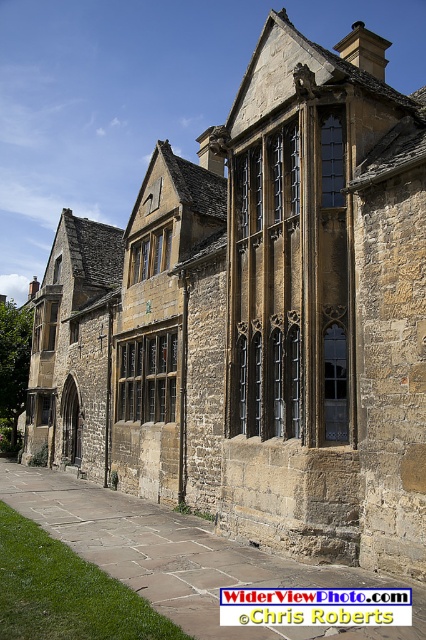
You are an architect examining the historic stone building. You notice a specific point on the facade at coordinates (x=147, y=378). Which architectural feature is located at this point?

The matte stone window at center is located at point (x=147, y=378).

You are standing in front of the historic stone building and want to take a photo. You notice two points on the building marked as point 1 at coordinates (327,186) and point 2 at coordinates (166,244). Which point is closer to your camera when taking the photo?

Point 1 at coordinates (327,186) is closer to the camera than point 2 at coordinates (166,244).